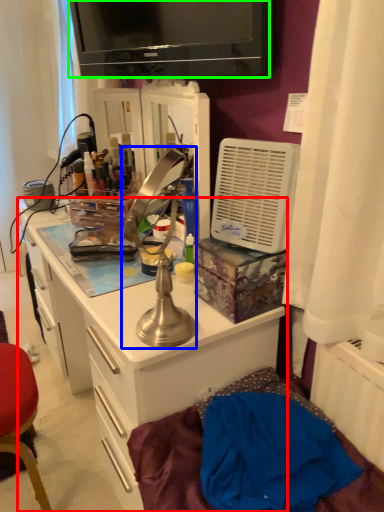
Question: Which object is the farthest from cabinetry (highlighted by a red box)? Choose among these: table lamp (highlighted by a blue box) or television (highlighted by a green box).

Choices:
 (A) table lamp
 (B) television

Answer: (B)